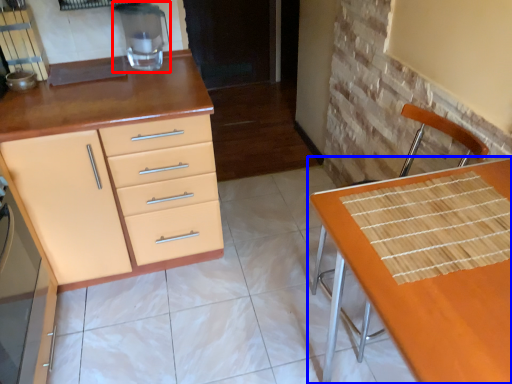
Question: Which object appears closest to the camera in this image, appliance (highlighted by a red box) or table (highlighted by a blue box)?

Choices:
 (A) appliance
 (B) table

Answer: (B)